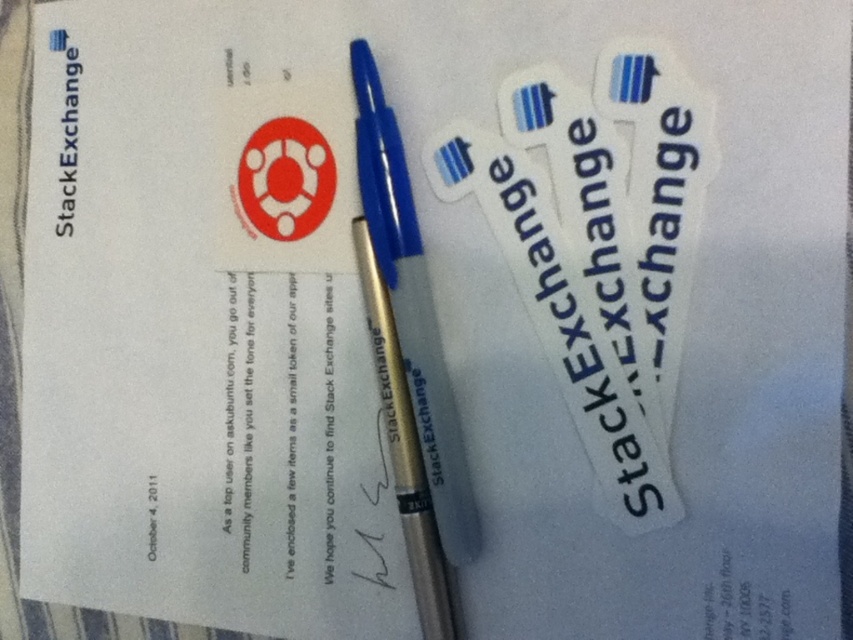
You are organizing a promotional event and have two pens to display next to a Stack Exchange card. You need to place them in a way that the metallic gold pen at center is on the left side of the gold metallic fountain pen at center. Is this arrangement possible based on the current setup?

The metallic gold pen at center is currently positioned on the right side of the gold metallic fountain pen at center. To place the metallic gold pen at center on the left side of the gold metallic fountain pen at center, you would need to swap their positions, which is possible by moving them accordingly.